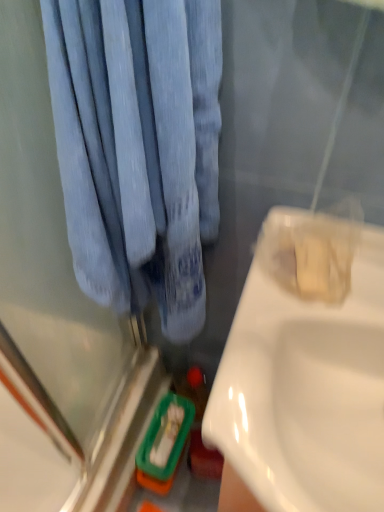
Image resolution: width=384 pixels, height=512 pixels. What do you see at coordinates (138, 148) in the screenshot?
I see `blue fabric curtain at upper left` at bounding box center [138, 148].

What are the coordinates of `blue fabric curtain at upper left` in the screenshot? It's located at tap(138, 148).

What do you see at coordinates (305, 385) in the screenshot? I see `white glossy sink at right` at bounding box center [305, 385].

In order to click on white glossy sink at right in this screenshot , I will do point(305,385).

Identify the location of blue fabric curtain at upper left. (138, 148).

Considering the relative positions of blue fabric curtain at upper left and white glossy sink at right in the image provided, is blue fabric curtain at upper left to the left of white glossy sink at right from the viewer's perspective?

Yes, blue fabric curtain at upper left is to the left of white glossy sink at right.

Considering their positions, is blue fabric curtain at upper left located in front of or behind white glossy sink at right?

blue fabric curtain at upper left is in front of white glossy sink at right.

Does point (114, 149) come in front of point (270, 285)?

Yes.

From the image's perspective, is blue fabric curtain at upper left above white glossy sink at right?

Yes, from the image's perspective, blue fabric curtain at upper left is above white glossy sink at right.

From a real-world perspective, which object rests below the other?

From a 3D spatial view, white glossy sink at right is below.

Which of these two, blue fabric curtain at upper left or white glossy sink at right, is thinner?

blue fabric curtain at upper left.

Does blue fabric curtain at upper left have a greater height compared to white glossy sink at right?

No.

Considering the sizes of objects blue fabric curtain at upper left and white glossy sink at right in the image provided, who is smaller, blue fabric curtain at upper left or white glossy sink at right?

blue fabric curtain at upper left is smaller.

Is blue fabric curtain at upper left located outside white glossy sink at right?

Yes, blue fabric curtain at upper left is not within white glossy sink at right.

Is blue fabric curtain at upper left far from white glossy sink at right?

blue fabric curtain at upper left is actually quite close to white glossy sink at right.

Could you tell me if blue fabric curtain at upper left is turned towards white glossy sink at right?

No, blue fabric curtain at upper left does not turn towards white glossy sink at right.

How many degrees apart are the facing directions of blue fabric curtain at upper left and white glossy sink at right?

blue fabric curtain at upper left and white glossy sink at right are facing 2.42 degrees away from each other.

Measure the distance from blue fabric curtain at upper left to white glossy sink at right.

blue fabric curtain at upper left is 9.00 inches from white glossy sink at right.

Image resolution: width=384 pixels, height=512 pixels. Identify the location of curtain that appears above the white glossy sink at right (from the image's perspective). (138, 148).

Considering the relative positions of white glossy sink at right and blue fabric curtain at upper left in the image provided, is white glossy sink at right to the left or to the right of blue fabric curtain at upper left?

From the image, it's evident that white glossy sink at right is to the right of blue fabric curtain at upper left.

Does white glossy sink at right lie behind blue fabric curtain at upper left?

Yes, it is.

Which is in front, point (382, 277) or point (88, 201)?

The point (88, 201) is in front.

From the image's perspective, which is above, white glossy sink at right or blue fabric curtain at upper left?

blue fabric curtain at upper left, from the image's perspective.

From a real-world perspective, between white glossy sink at right and blue fabric curtain at upper left, who is vertically lower?

white glossy sink at right is physically lower.

Considering the relative sizes of white glossy sink at right and blue fabric curtain at upper left in the image provided, is white glossy sink at right thinner than blue fabric curtain at upper left?

In fact, white glossy sink at right might be wider than blue fabric curtain at upper left.

Considering the sizes of white glossy sink at right and blue fabric curtain at upper left in the image, is white glossy sink at right taller or shorter than blue fabric curtain at upper left?

Considering their sizes, white glossy sink at right has more height than blue fabric curtain at upper left.

In terms of size, does white glossy sink at right appear bigger or smaller than blue fabric curtain at upper left?

Clearly, white glossy sink at right is larger in size than blue fabric curtain at upper left.

Is white glossy sink at right completely or partially outside of blue fabric curtain at upper left?

white glossy sink at right lies outside blue fabric curtain at upper left's area.

Would you say white glossy sink at right is a long distance from blue fabric curtain at upper left?

Actually, white glossy sink at right and blue fabric curtain at upper left are a little close together.

Is blue fabric curtain at upper left at the back of white glossy sink at right?

No, white glossy sink at right's orientation is not away from blue fabric curtain at upper left.

Can you tell me how much white glossy sink at right and blue fabric curtain at upper left differ in facing direction?

The angle between the facing direction of white glossy sink at right and the facing direction of blue fabric curtain at upper left is 2.42 degrees.

Identify the location of sink below the blue fabric curtain at upper left (from the image's perspective). (305, 385).

Locate an element on the screen. curtain above the white glossy sink at right (from a real-world perspective) is located at coordinates (138, 148).

Where is `sink on the right of the blue fabric curtain at upper left`? sink on the right of the blue fabric curtain at upper left is located at coordinates (305, 385).